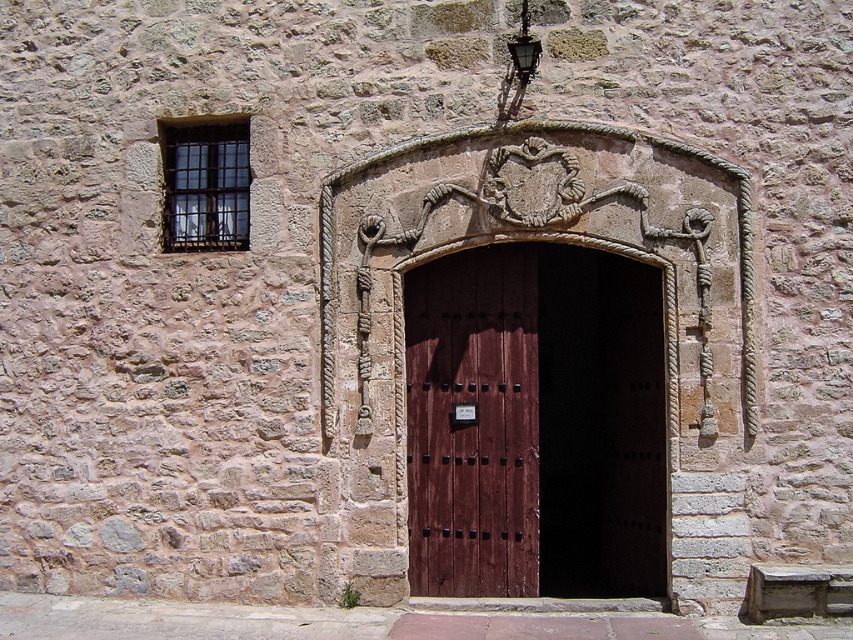
Question: Is dark wood door at center thinner than smooth dark wood door at center?

Choices:
 (A) yes
 (B) no

Answer: (A)

Question: Which point appears farthest from the camera in this image?

Choices:
 (A) (433, 323)
 (B) (509, 538)

Answer: (A)

Question: Observing the image, what is the correct spatial positioning of dark wood door at center in reference to smooth dark wood door at center?

Choices:
 (A) right
 (B) left

Answer: (A)

Question: Is dark wood door at center closer to the viewer compared to smooth dark wood door at center?

Choices:
 (A) yes
 (B) no

Answer: (A)

Question: Among these objects, which one is farthest from the camera?

Choices:
 (A) smooth dark wood door at center
 (B) dark wood door at center

Answer: (A)